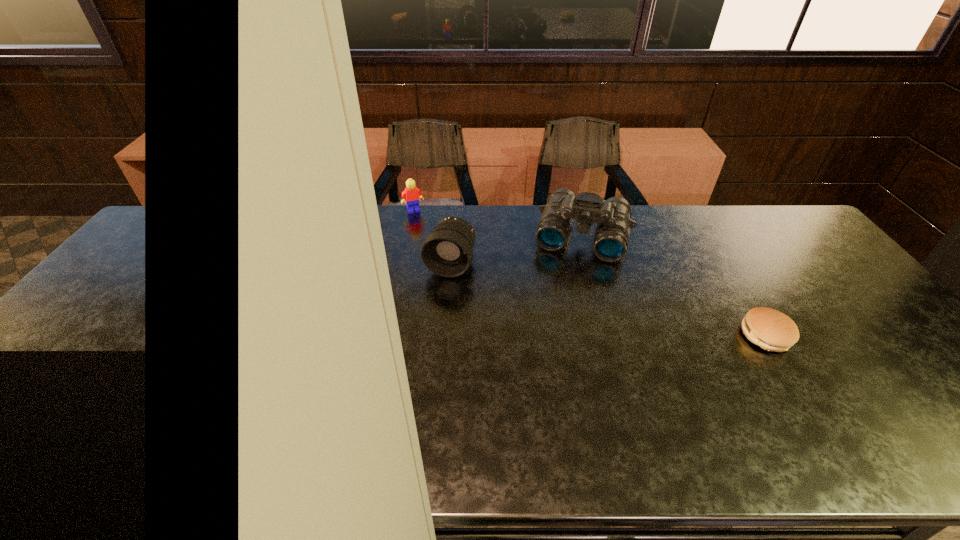
You are a GUI agent. You are given a task and a screenshot of the screen. Output one action in this format:
    pyautogui.click(x=<x>, y=<y>)
    Task: Click on the vacant region that satisfies the following two spatial constraints: 1. on the front side of the telephoto lens; 2. on the left side of the third tallest object
    
    Given the screenshot: What is the action you would take?
    pyautogui.click(x=403, y=264)